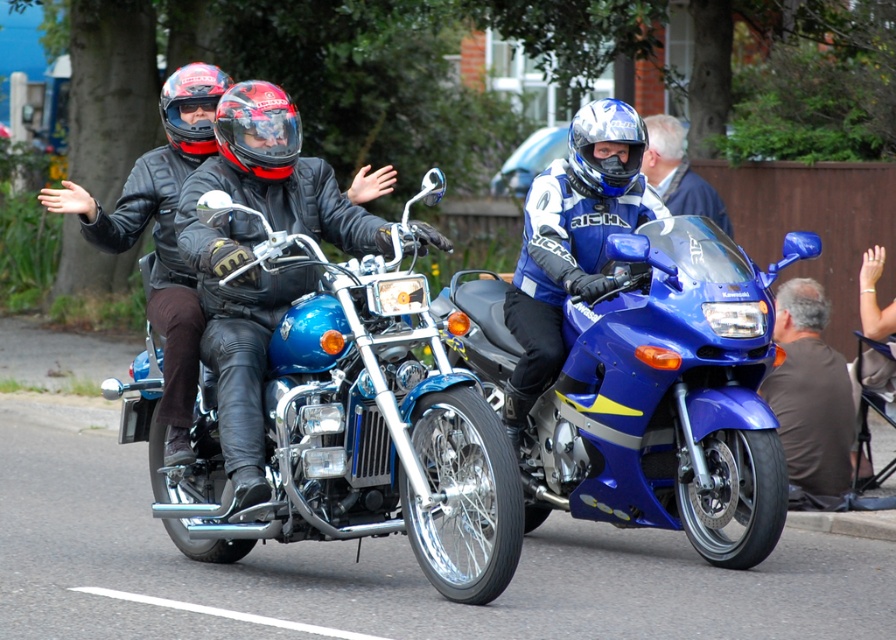
Question: Is shiny chrome motorcycle at center positioned at the back of matte black helmet at upper center?

Choices:
 (A) no
 (B) yes

Answer: (A)

Question: Is the position of brown cotton shirt at lower right less distant than that of blue matte helmet at center?

Choices:
 (A) yes
 (B) no

Answer: (B)

Question: Which object appears closest to the camera in this image?

Choices:
 (A) matte black helmet at upper center
 (B) blue matte helmet at center

Answer: (B)

Question: Which object is closer to the camera taking this photo?

Choices:
 (A) matte black helmet at upper center
 (B) black matte goggles at center
 (C) shiny black helmet at center

Answer: (C)

Question: Observing the image, what is the correct spatial positioning of matte black leather jacket at center in reference to blue matte helmet at center?

Choices:
 (A) right
 (B) left

Answer: (B)

Question: Which of the following is the closest to the observer?

Choices:
 (A) (655, 499)
 (B) (164, 374)
 (C) (212, 100)

Answer: (B)